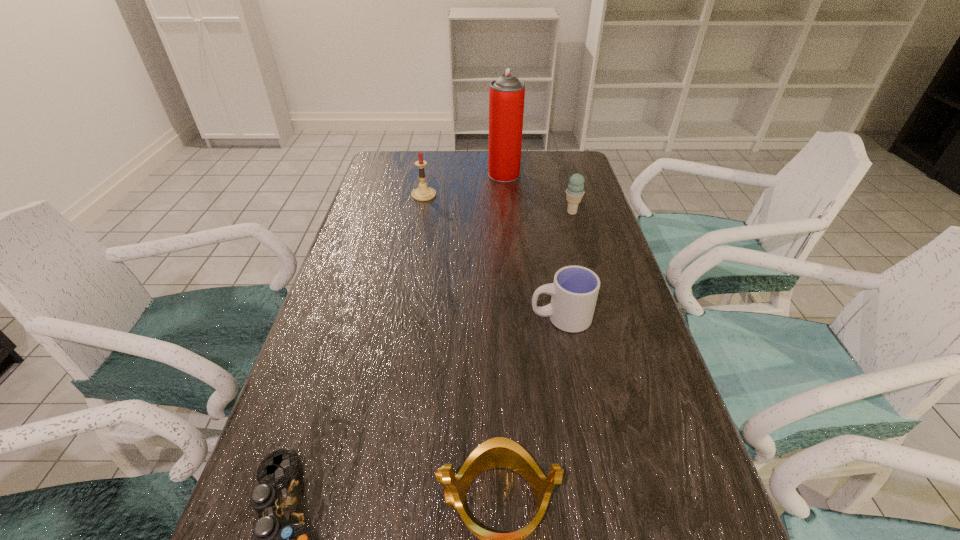
Image resolution: width=960 pixels, height=540 pixels. I want to click on aerosol can, so click(507, 93).

At what (x,y) coordinates should I click in order to perform the action: click on the farthest object. Please return your answer as a coordinate pair (x, y). Looking at the image, I should click on (507, 93).

Where is `the fifth nearest object`? the fifth nearest object is located at coordinates (423, 193).

You are a GUI agent. You are given a task and a screenshot of the screen. Output one action in this format:
    pyautogui.click(x=<x>, y=<y>)
    Task: Click on the fifth object from right to left
    The width and height of the screenshot is (960, 540).
    Given the screenshot: What is the action you would take?
    pyautogui.click(x=423, y=193)

You are a GUI agent. You are given a task and a screenshot of the screen. Output one action in this format:
    pyautogui.click(x=<x>, y=<y>)
    Task: Click on the third farthest object
    The width and height of the screenshot is (960, 540).
    Given the screenshot: What is the action you would take?
    pyautogui.click(x=574, y=193)

At what (x,y) coordinates should I click in order to perform the action: click on the third nearest object. Please return your answer as a coordinate pair (x, y). The width and height of the screenshot is (960, 540). Looking at the image, I should click on (574, 292).

Locate an element on the screen. This screenshot has width=960, height=540. vacant space located 0.370m on the left of the aerosol can is located at coordinates (383, 175).

Locate an element on the screen. This screenshot has height=540, width=960. vacant space located on the right of the candle is located at coordinates (479, 195).

Locate an element on the screen. free location located on the back of the ice cream is located at coordinates pyautogui.click(x=562, y=177).

Locate an element on the screen. vacant space located 0.100m with the handle on the side of the fourth farthest object is located at coordinates (488, 318).